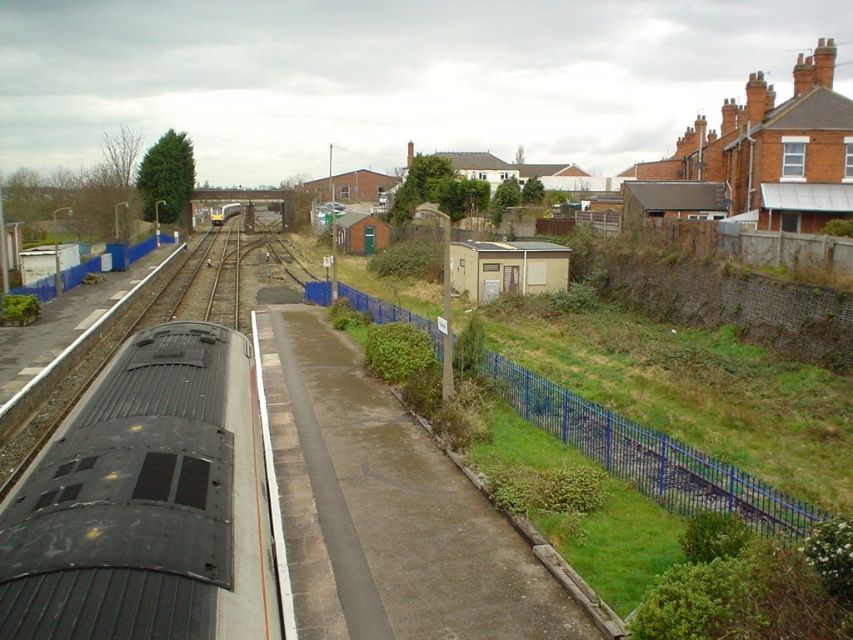
Question: Is matte black train at left to the left of blue metal fence at center-right from the viewer's perspective?

Choices:
 (A) no
 (B) yes

Answer: (B)

Question: Does matte black train at left have a greater width compared to blue metal fence at center-right?

Choices:
 (A) no
 (B) yes

Answer: (A)

Question: Is matte black train at left further to the viewer compared to blue metal fence at center-right?

Choices:
 (A) no
 (B) yes

Answer: (A)

Question: Which point is farther to the camera?

Choices:
 (A) (674, 506)
 (B) (86, 481)

Answer: (A)

Question: Which point is closer to the camera?

Choices:
 (A) matte black train at left
 (B) blue metal fence at center-right

Answer: (A)